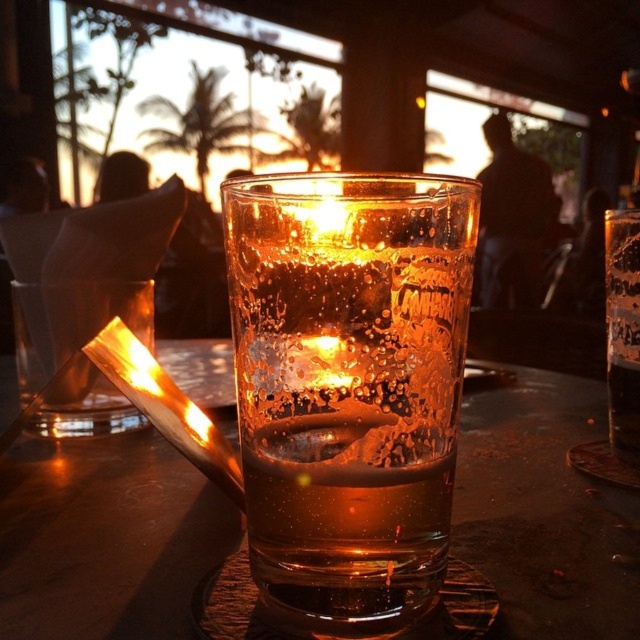
You are at a bar and want to choose between the translucent glass at center and the transparent glass at center. Which glass has a smaller width?

The translucent glass at center has a lesser width compared to transparent glass at center, so the translucent glass at center is smaller in width.

You are a bartender trying to clean the items on the table. You have a 15 cm high shelf. Can you place both the translucent glass at center and the translucent glass beer at center on the shelf without stacking them?

The translucent glass at center has a greater height compared to translucent glass beer at center. Since the shelf is 15 cm high, and the taller translucent glass at center exceeds this height, neither of them can be placed on the shelf without stacking.

You are a bartender who needs to clean the transparent glass at center and the translucent glass beer at center. Which one should you handle first if you want to clean the one closer to you?

The transparent glass at center is in front of the translucent glass beer at center, so you should clean the transparent glass at center first since it is closer to you.